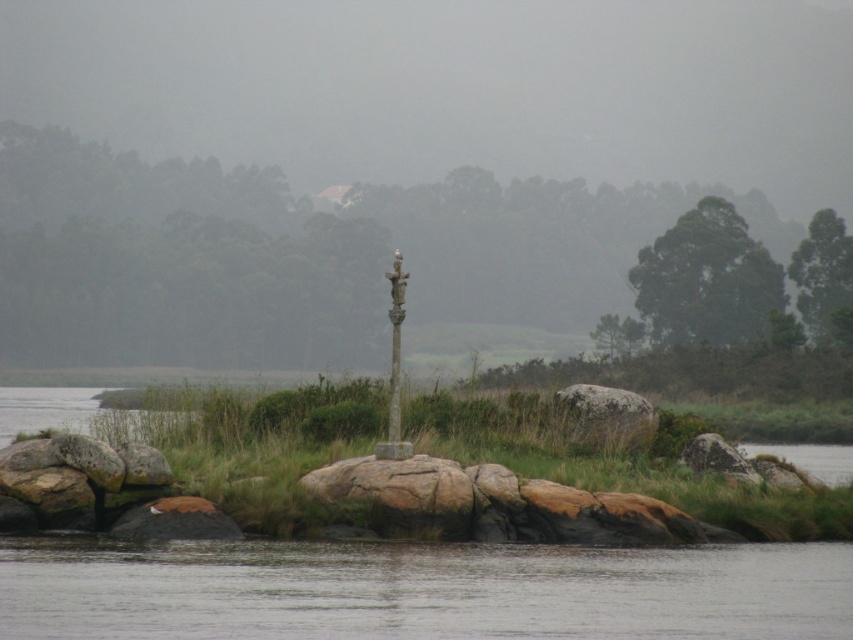
You are an environmental scientist assessing the biodiversity of this area. You notice the green leafy tree at upper right and the gray rough rock at center. Which object has a larger horizontal spread in terms of width?

The green leafy tree at upper right might be wider than gray rough rock at center, so it likely has a larger horizontal spread in terms of width.

You are a hiker who wants to take a photo of the green matte tree at center and the green textured tree at upper center. Which tree should you stand closer to in order to capture both in a single frame?

You should stand closer to the green textured tree at upper center because the green matte tree at center is taller than the green textured tree at upper center, so moving closer to the shorter tree will help include both in the frame.